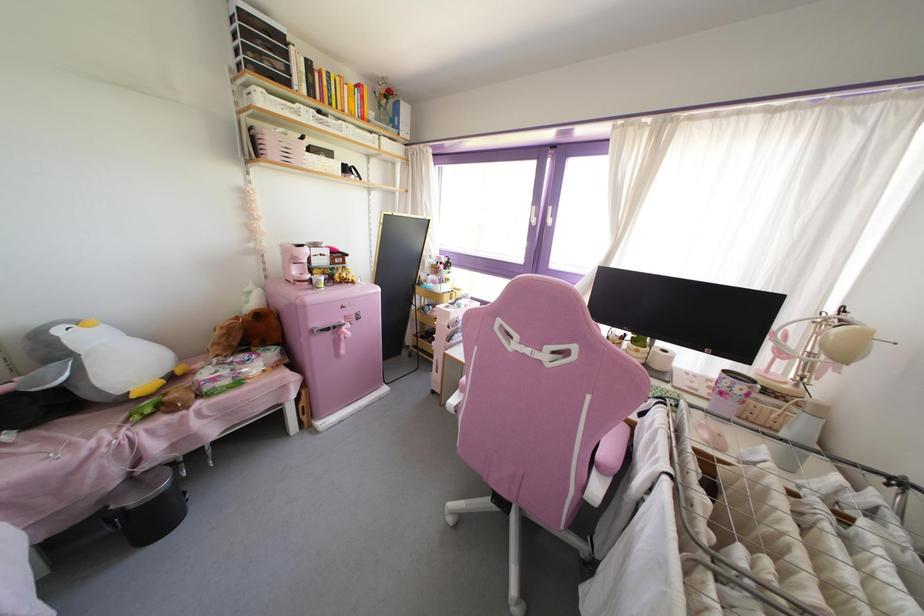
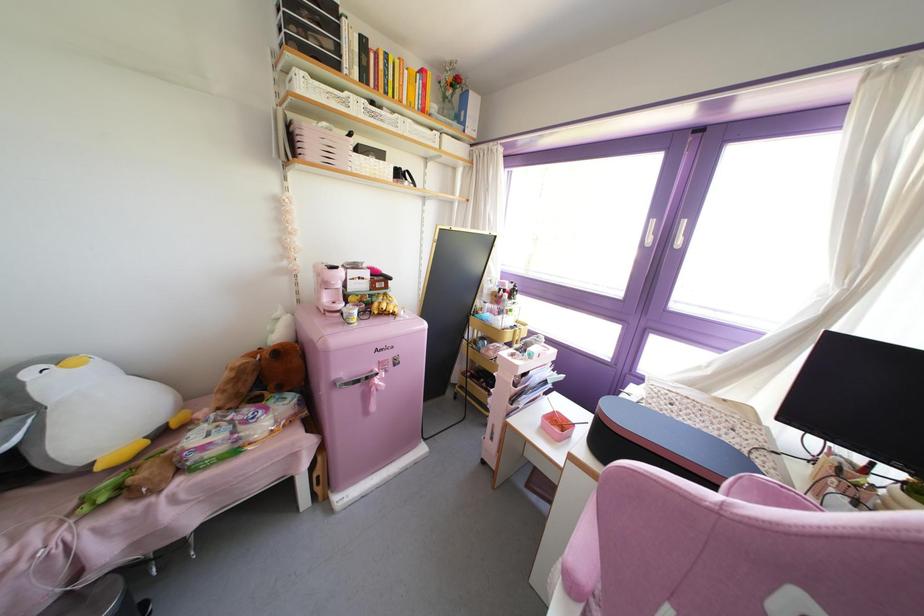
Which direction would the cameraman need to move to produce the second image?

The cameraman moved toward left, forward.